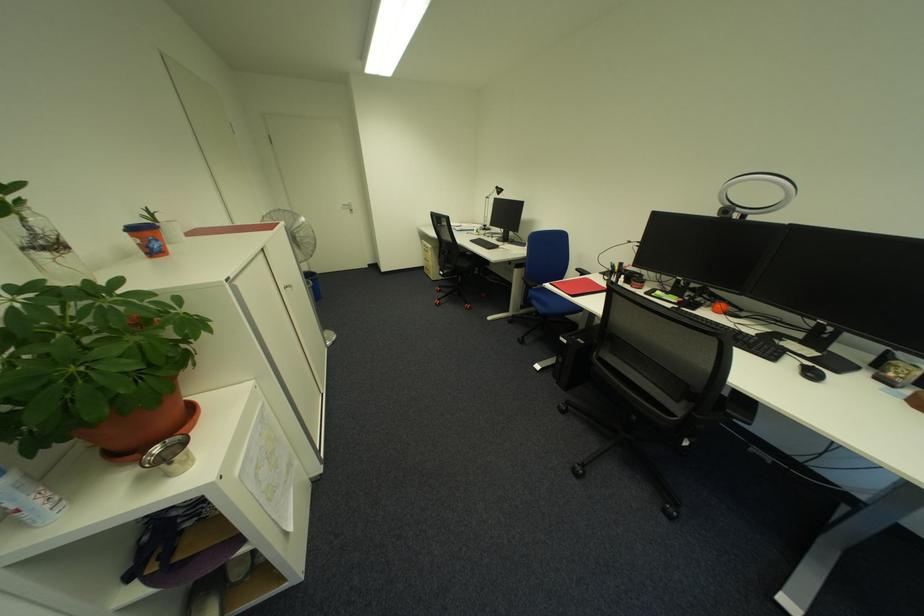
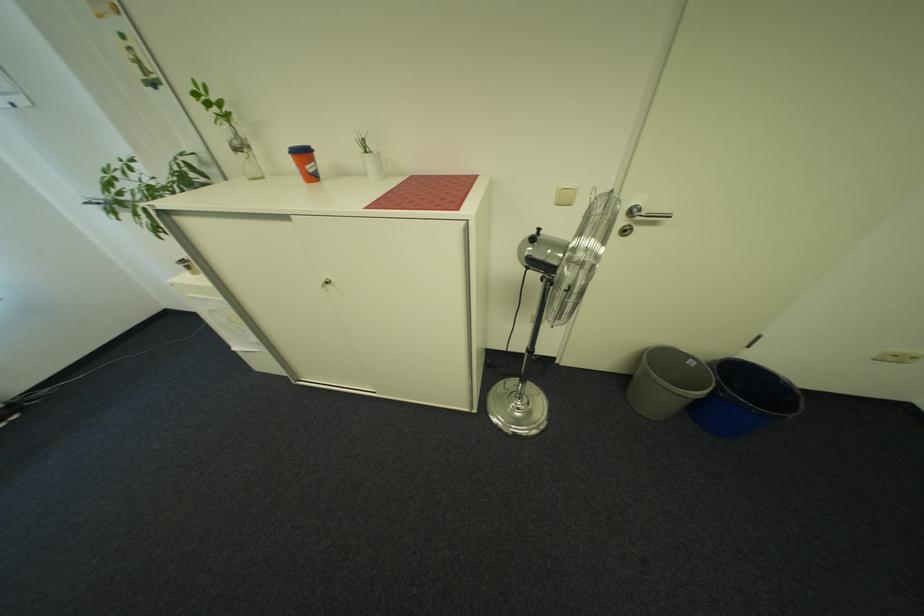
Where in the second image is the point corresponding to (322,288) from the first image?

(707, 403)